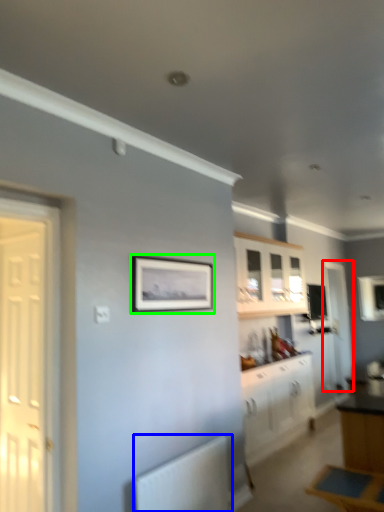
Question: Considering the real-world distances, which object is farthest from door (highlighted by a red box)? radiator (highlighted by a blue box) or picture frame (highlighted by a green box)?

Choices:
 (A) radiator
 (B) picture frame

Answer: (A)